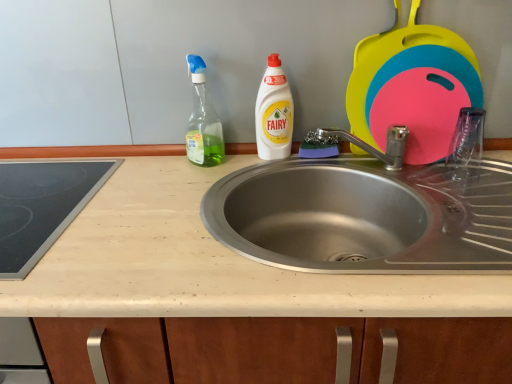
Question: Considering the positions of beige laminate countertop at center and white plastic bottle at center, acting as the 1th cleaning product starting from the right, in the image, is beige laminate countertop at center bigger or smaller than white plastic bottle at center, acting as the 1th cleaning product starting from the right,?

Choices:
 (A) small
 (B) big

Answer: (B)

Question: From the image's perspective, relative to white plastic bottle at center, placed as the second cleaning product when sorted from left to right, is beige laminate countertop at center above or below?

Choices:
 (A) above
 (B) below

Answer: (B)

Question: Which object is positioned farthest from the green glass spray bottle at upper left, which is the 2th cleaning product in right-to-left order?

Choices:
 (A) black glass cooktop at left
 (B) white plastic bottle at center, placed as the second cleaning product when sorted from left to right
 (C) beige laminate countertop at center

Answer: (A)

Question: Based on their relative distances, which object is nearer to the beige laminate countertop at center?

Choices:
 (A) green glass spray bottle at upper left, which is the 2th cleaning product in right-to-left order
 (B) white plastic bottle at center, acting as the 1th cleaning product starting from the right
 (C) black glass cooktop at left

Answer: (C)